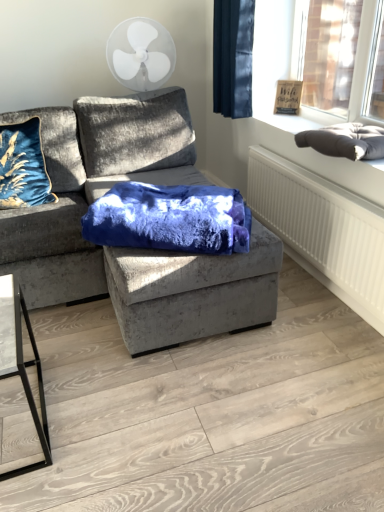
In order to face velvet blue pillow at left, should I rotate leftwards or rightwards?

Rotate left and turn 21.997 degrees.

Looking at this image, in order to face matte brown wooden picture frame at upper right, should I rotate leftwards or rightwards?

It's best to rotate right around 12.606 degrees.

What do you see at coordinates (322, 229) in the screenshot? The image size is (384, 512). I see `white textured radiator at lower right` at bounding box center [322, 229].

Locate an element on the screen. The width and height of the screenshot is (384, 512). velvet blue blanket at center is located at coordinates (170, 219).

From the image's perspective, which one is positioned lower, white plastic fan at upper center or velvet blue blanket at center?

velvet blue blanket at center is shown below in the image.

Based on the photo, which object is positioned more to the left, white plastic fan at upper center or velvet blue blanket at center?

Positioned to the left is white plastic fan at upper center.

In order to click on mechanical fan on the left of velvet blue blanket at center in this screenshot , I will do `click(141, 54)`.

Can you confirm if white plastic fan at upper center is wider than velvet blue blanket at center?

No.

Can we say dark blue velvet curtain at upper right lies outside dark gray cushion at upper right?

Indeed, dark blue velvet curtain at upper right is completely outside dark gray cushion at upper right.

From the image's perspective, relative to dark gray cushion at upper right, is dark blue velvet curtain at upper right above or below?

From the image's perspective, dark blue velvet curtain at upper right appears above dark gray cushion at upper right.

Who is bigger, dark blue velvet curtain at upper right or dark gray cushion at upper right?

Answer: With larger size is dark blue velvet curtain at upper right.

From a real-world perspective, is dark blue velvet curtain at upper right physically located above or below dark gray cushion at upper right?

dark blue velvet curtain at upper right is above dark gray cushion at upper right.

Considering the sizes of velvet blue pillow at left and velvet gray couch at center in the image, is velvet blue pillow at left taller or shorter than velvet gray couch at center?

velvet blue pillow at left is shorter than velvet gray couch at center.

Considering the relative sizes of velvet blue pillow at left and velvet gray couch at center in the image provided, is velvet blue pillow at left thinner than velvet gray couch at center?

Yes, velvet blue pillow at left is thinner than velvet gray couch at center.

In the scene shown: Which of these two, velvet blue pillow at left or velvet gray couch at center, is bigger?

With larger size is velvet gray couch at center.

From the image's perspective, is velvet blue pillow at left on velvet gray couch at center?

Indeed, from the image's perspective, velvet blue pillow at left is shown above velvet gray couch at center.

Between dark blue velvet curtain at upper right and dark gray plush cushion at upper right, which one has larger size?

With larger size is dark blue velvet curtain at upper right.

From a real-world perspective, which is physically above, dark blue velvet curtain at upper right or dark gray plush cushion at upper right?

In real-world perspective, dark blue velvet curtain at upper right is above.

Considering the positions of objects dark blue velvet curtain at upper right and dark gray plush cushion at upper right in the image provided, who is more to the left, dark blue velvet curtain at upper right or dark gray plush cushion at upper right?

Positioned to the left is dark blue velvet curtain at upper right.

Is point (221, 73) less distant than point (370, 139)?

No.

Does point (319, 187) lie in front of point (231, 3)?

That is True.

From the image's perspective, would you say white textured radiator at lower right is positioned over dark blue velvet curtain at upper right?

Actually, white textured radiator at lower right appears below dark blue velvet curtain at upper right in the image.

Which of these two, white textured radiator at lower right or dark blue velvet curtain at upper right, is smaller?

With smaller size is white textured radiator at lower right.

Does white textured radiator at lower right have a lesser height compared to dark blue velvet curtain at upper right?

Yes.

Which is more to the left, velvet blue pillow at left or dark gray plush cushion at upper right?

Positioned to the left is velvet blue pillow at left.

Which is behind, velvet blue pillow at left or dark gray plush cushion at upper right?

velvet blue pillow at left is behind.

Where is `throw pillow located on the left of dark gray plush cushion at upper right`? throw pillow located on the left of dark gray plush cushion at upper right is located at coordinates (23, 166).

How many degrees apart are the facing directions of dark gray plush cushion at upper right and matte brown wooden picture frame at upper right?

The angular difference between dark gray plush cushion at upper right and matte brown wooden picture frame at upper right is 37.9 degrees.

Which of these two, dark gray plush cushion at upper right or matte brown wooden picture frame at upper right, is smaller?

matte brown wooden picture frame at upper right.

Is point (339, 127) closer or farther from the camera than point (287, 103)?

Clearly, point (339, 127) is closer to the camera than point (287, 103).

Is dark gray plush cushion at upper right thinner than matte brown wooden picture frame at upper right?

No.

Where is `mechanical fan above the velvet blue blanket at center (from the image's perspective)`? mechanical fan above the velvet blue blanket at center (from the image's perspective) is located at coordinates (141, 54).

At what (x,y) coordinates should I click in order to perform the action: click on curtain that is above the dark gray cushion at upper right (from a real-world perspective). Please return your answer as a coordinate pair (x, y). The image size is (384, 512). Looking at the image, I should click on (233, 57).

Looking at the image, which one is located further to dark gray cushion at upper right, velvet gray couch at center or velvet blue blanket at center?

velvet gray couch at center.

From the image, which object appears to be nearer to dark blue velvet curtain at upper right, dark gray plush cushion at upper right or white textured radiator at lower right?

white textured radiator at lower right.

Which object lies further to the anchor point white textured radiator at lower right, velvet gray couch at center or matte brown wooden picture frame at upper right?

matte brown wooden picture frame at upper right is further to white textured radiator at lower right.

Looking at this image, when comparing their distances from velvet blue blanket at center, does matte brown wooden picture frame at upper right or white plastic fan at upper center seem closer?

matte brown wooden picture frame at upper right is closer to velvet blue blanket at center.

Estimate the real-world distances between objects in this image. Which object is further from white textured radiator at lower right, dark gray plush cushion at upper right or velvet blue blanket at center?

Among the two, velvet blue blanket at center is located further to white textured radiator at lower right.

Which object lies further to the anchor point dark gray cushion at upper right, dark blue velvet curtain at upper right or matte brown wooden picture frame at upper right?

The object further to dark gray cushion at upper right is dark blue velvet curtain at upper right.

Which object lies further to the anchor point white textured radiator at lower right, dark gray cushion at upper right or white plastic fan at upper center?

white plastic fan at upper center is further to white textured radiator at lower right.

Which object lies further to the anchor point dark gray cushion at upper right, matte brown wooden picture frame at upper right or velvet blue pillow at left?

Based on the image, velvet blue pillow at left appears to be further to dark gray cushion at upper right.

Where is `window sill between velvet gray couch at center and white plastic fan at upper center along the z-axis`? Image resolution: width=384 pixels, height=512 pixels. window sill between velvet gray couch at center and white plastic fan at upper center along the z-axis is located at coordinates (289, 121).

Locate an element on the screen. The image size is (384, 512). picture frame between white plastic fan at upper center and dark gray plush cushion at upper right is located at coordinates (288, 97).

Where is `blanket that lies between white plastic fan at upper center and white textured radiator at lower right from top to bottom`? The width and height of the screenshot is (384, 512). blanket that lies between white plastic fan at upper center and white textured radiator at lower right from top to bottom is located at coordinates (170, 219).

Find the location of a particular element. This screenshot has width=384, height=512. window sill located between dark gray plush cushion at upper right and matte brown wooden picture frame at upper right in the depth direction is located at coordinates (289, 121).